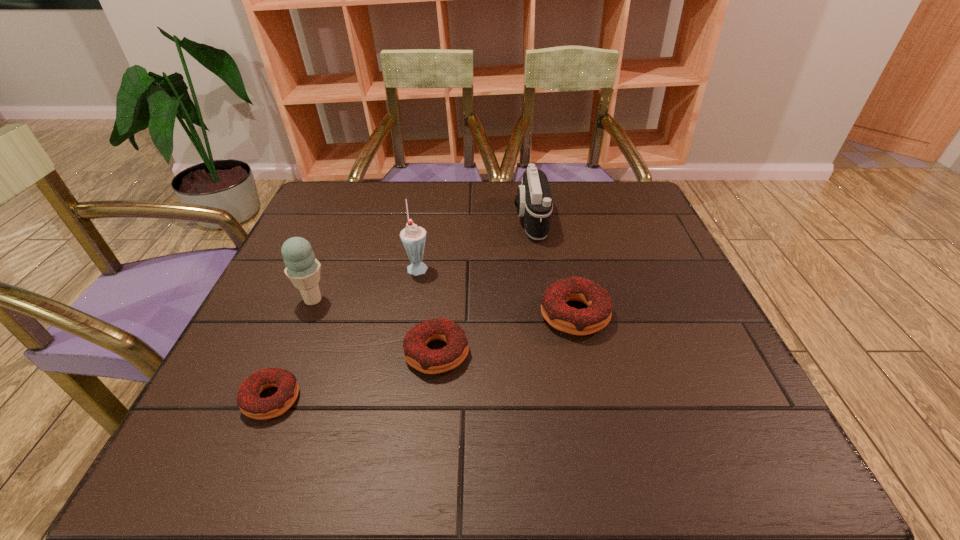
The width and height of the screenshot is (960, 540). In order to click on ice cream that is at the left edge in this screenshot , I will do point(302,268).

The height and width of the screenshot is (540, 960). In order to click on object positioned at the near left corner in this screenshot , I will do `click(248, 400)`.

Where is `vacant space at the far edge of the desktop`? Image resolution: width=960 pixels, height=540 pixels. vacant space at the far edge of the desktop is located at coordinates (396, 183).

Where is `vacant space at the near edge of the desktop`? This screenshot has height=540, width=960. vacant space at the near edge of the desktop is located at coordinates (496, 384).

Locate an element on the screen. vacant space at the left edge is located at coordinates (278, 284).

The image size is (960, 540). I want to click on vacant area at the right edge, so click(x=671, y=349).

The width and height of the screenshot is (960, 540). Identify the location of vacant space at the far left corner of the desktop. (338, 181).

Find the location of a particular element. The width and height of the screenshot is (960, 540). blank space at the far right corner of the desktop is located at coordinates (623, 197).

You are a GUI agent. You are given a task and a screenshot of the screen. Output one action in this format:
    pyautogui.click(x=<x>, y=<y>)
    Task: Click on the empty location between the fifth tallest object and the third shortest object
    This screenshot has width=960, height=540.
    Given the screenshot: What is the action you would take?
    pyautogui.click(x=506, y=334)

Image resolution: width=960 pixels, height=540 pixels. I want to click on vacant space that is in between the third shortest object and the fifth tallest object, so click(506, 334).